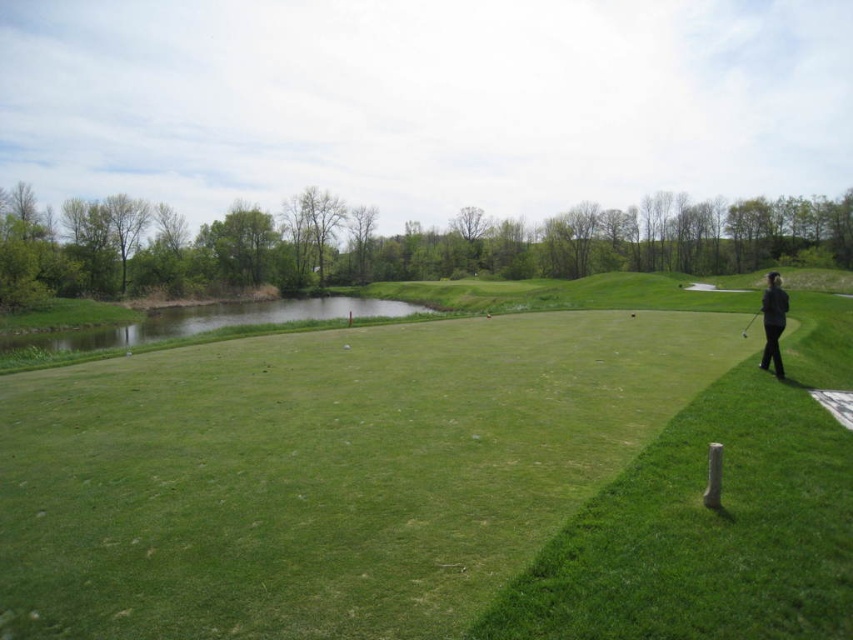
Question: Where is green grassy golf course at center located in relation to black fabric person at right in the image?

Choices:
 (A) above
 (B) below

Answer: (B)

Question: Which point is closer to the camera?

Choices:
 (A) black fabric person at right
 (B) green grassy golf course at center

Answer: (B)

Question: Which of the following is the farthest from the observer?

Choices:
 (A) (36, 352)
 (B) (779, 285)

Answer: (A)

Question: Can you confirm if green grassy pond at left is bigger than black fabric person at right?

Choices:
 (A) yes
 (B) no

Answer: (A)

Question: Considering the real-world distances, which object is closest to the green grassy golf course at center?

Choices:
 (A) black fabric person at right
 (B) metallic silver golf club at right
 (C) green grassy pond at left

Answer: (A)

Question: Is green grassy golf course at center positioned in front of metallic silver golf club at right?

Choices:
 (A) yes
 (B) no

Answer: (A)